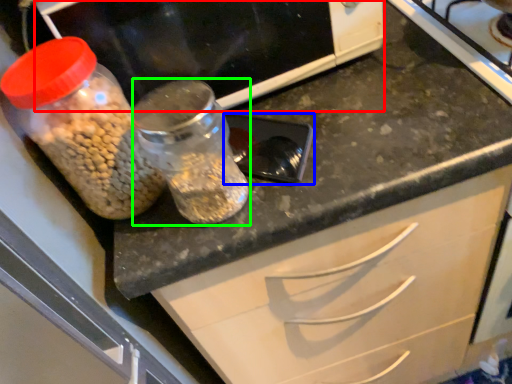
Question: Which object is the closest to the wide (highlighted by a red box)? Choose among these: appliance (highlighted by a blue box) or glass jar (highlighted by a green box).

Choices:
 (A) appliance
 (B) glass jar

Answer: (A)